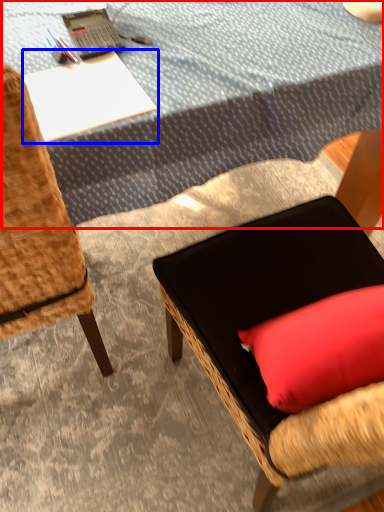
Question: Among these objects, which one is nearest to the camera, tablecloth (highlighted by a red box) or desk (highlighted by a blue box)?

Choices:
 (A) tablecloth
 (B) desk

Answer: (B)